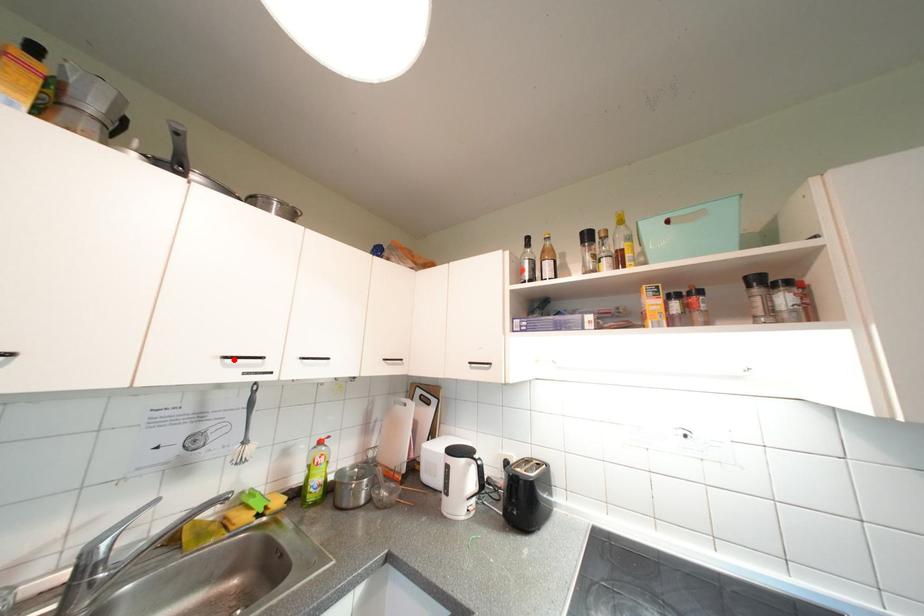
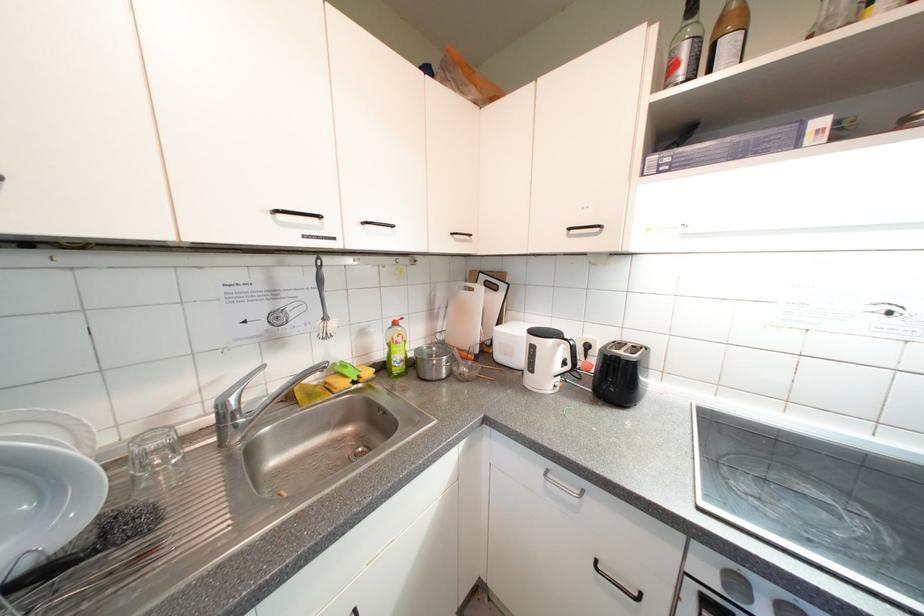
Where in the second image is the point corresponding to the highlighted location from the first image?

(285, 214)